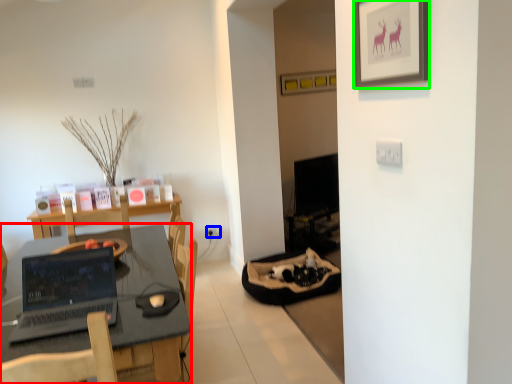
Question: Estimate the real-world distances between objects in this image. Which object is closer to desk (highlighted by a red box), electric outlet (highlighted by a blue box) or picture frame (highlighted by a green box)?

Choices:
 (A) electric outlet
 (B) picture frame

Answer: (B)